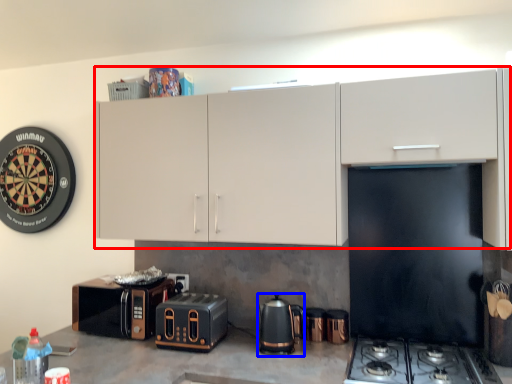
Question: Which object appears farthest to the camera in this image, cabinetry (highlighted by a red box) or kitchen appliance (highlighted by a blue box)?

Choices:
 (A) cabinetry
 (B) kitchen appliance

Answer: (B)